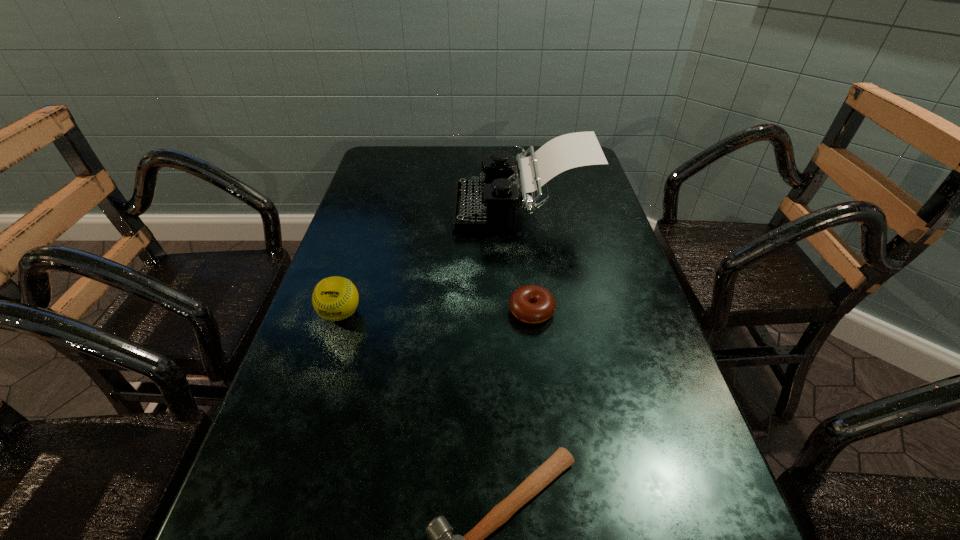
Identify the location of the closest object to the third tallest object. (479, 205).

Point out which object is positioned as the third nearest to the third tallest object. Please provide its 2D coordinates. Your answer should be formatted as a tuple, i.e. [(x, y)], where the tuple contains the x and y coordinates of a point satisfying the conditions above.

[(335, 298)]

The height and width of the screenshot is (540, 960). Find the location of `vacant region that satisfies the following two spatial constraints: 1. on the keys of the tallest object; 2. on the logo side of the leftmost object`. vacant region that satisfies the following two spatial constraints: 1. on the keys of the tallest object; 2. on the logo side of the leftmost object is located at coordinates (534, 314).

Where is `free location that satisfies the following two spatial constraints: 1. on the keys of the farthest object; 2. on the logo side of the second tallest object`? Image resolution: width=960 pixels, height=540 pixels. free location that satisfies the following two spatial constraints: 1. on the keys of the farthest object; 2. on the logo side of the second tallest object is located at coordinates (534, 314).

Locate an element on the screen. vacant region that satisfies the following two spatial constraints: 1. on the keys of the typewriter; 2. on the logo side of the leftmost object is located at coordinates (534, 314).

The width and height of the screenshot is (960, 540). What are the coordinates of `vacant space that satisfies the following two spatial constraints: 1. on the keys of the typewriter; 2. on the logo side of the softball` in the screenshot? It's located at (534, 314).

The height and width of the screenshot is (540, 960). What are the coordinates of `blank space that satisfies the following two spatial constraints: 1. on the keys of the typewriter; 2. on the logo side of the softball` in the screenshot? It's located at [x=534, y=314].

Image resolution: width=960 pixels, height=540 pixels. In order to click on vacant space that satisfies the following two spatial constraints: 1. on the keys of the typewriter; 2. on the logo side of the leftmost object in this screenshot , I will do `click(534, 314)`.